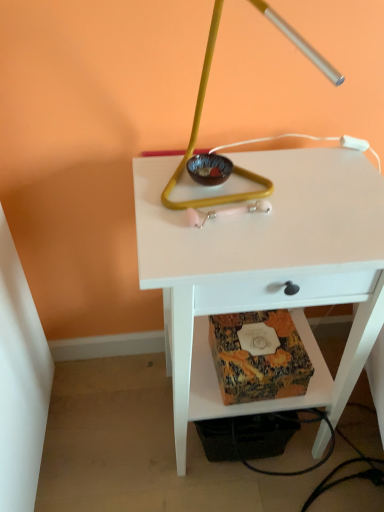
The image size is (384, 512). I want to click on free space in front of matte brown glass bowl at center, so click(x=218, y=229).